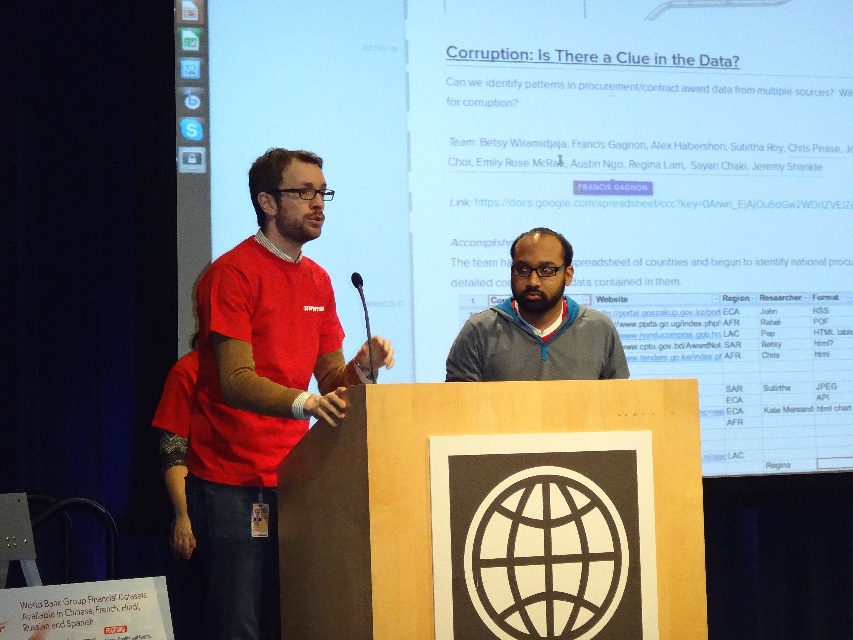
Question: Among these points, which one is nearest to the camera?

Choices:
 (A) (558, 336)
 (B) (242, 512)

Answer: (B)

Question: Is matte red shirt at left to the right of matte gray hoodie at center from the viewer's perspective?

Choices:
 (A) no
 (B) yes

Answer: (A)

Question: Can you confirm if matte red shirt at left is bigger than matte gray hoodie at center?

Choices:
 (A) yes
 (B) no

Answer: (A)

Question: Where is matte red shirt at left located in relation to matte gray hoodie at center in the image?

Choices:
 (A) below
 (B) above

Answer: (A)

Question: Which object is farther from the camera taking this photo?

Choices:
 (A) matte red shirt at left
 (B) matte gray hoodie at center

Answer: (B)